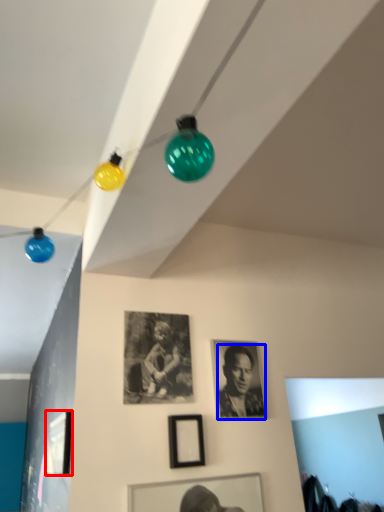
Question: Which object appears farthest to the camera in this image, picture frame (highlighted by a red box) or person (highlighted by a blue box)?

Choices:
 (A) picture frame
 (B) person

Answer: (B)